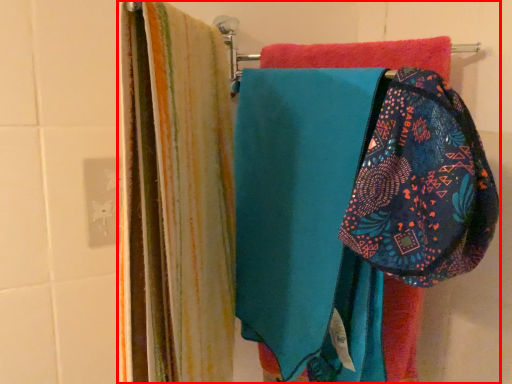
Question: In this image, where is laundry (annotated by the red box) located relative to pouch?

Choices:
 (A) left
 (B) right

Answer: (A)